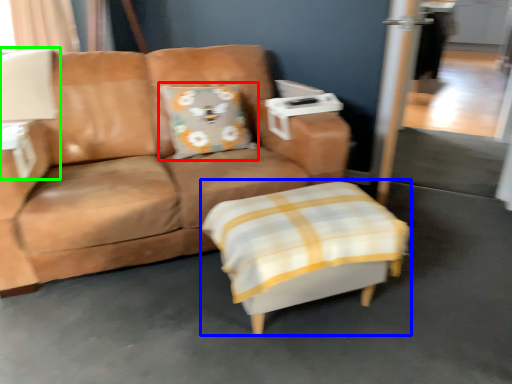
Question: Based on their relative distances, which object is nearer to pillow (highlighted by a red box)? Choose from swivel chair (highlighted by a blue box) and table lamp (highlighted by a green box).

Choices:
 (A) swivel chair
 (B) table lamp

Answer: (B)